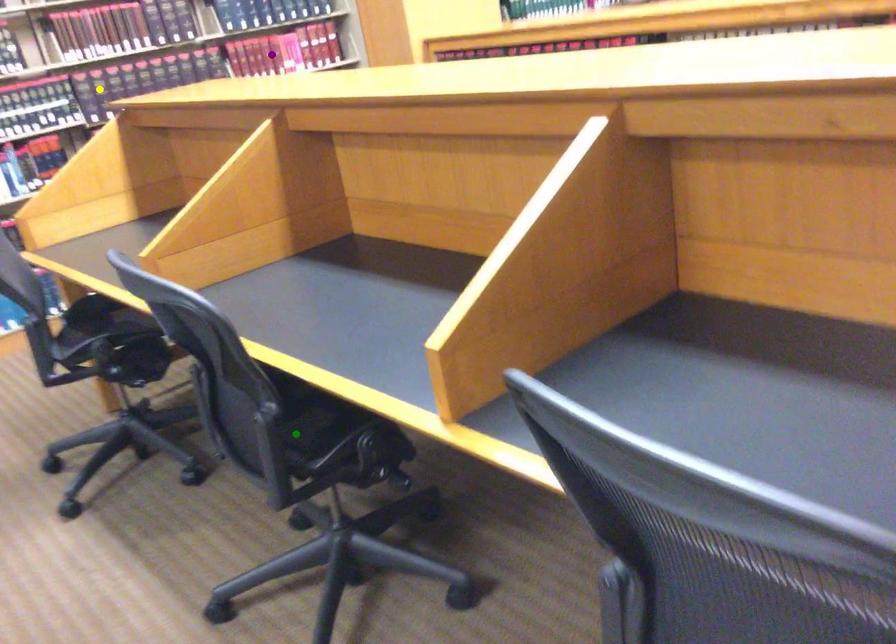
Order these from nearest to farthest:
purple point | green point | yellow point

green point → yellow point → purple point